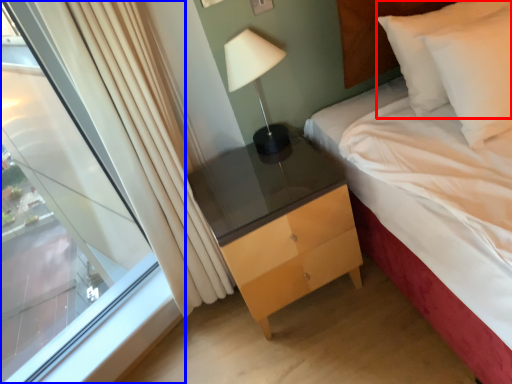
Question: Which of the following is the closest to the observer, pillow (highlighted by a red box) or window (highlighted by a blue box)?

Choices:
 (A) pillow
 (B) window

Answer: (B)